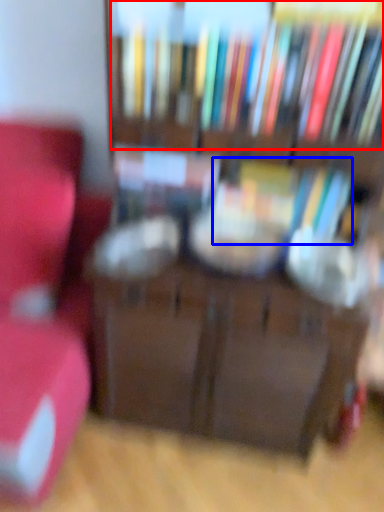
Question: Which object appears closest to the camera in this image, book (highlighted by a red box) or book (highlighted by a blue box)?

Choices:
 (A) book
 (B) book

Answer: (A)